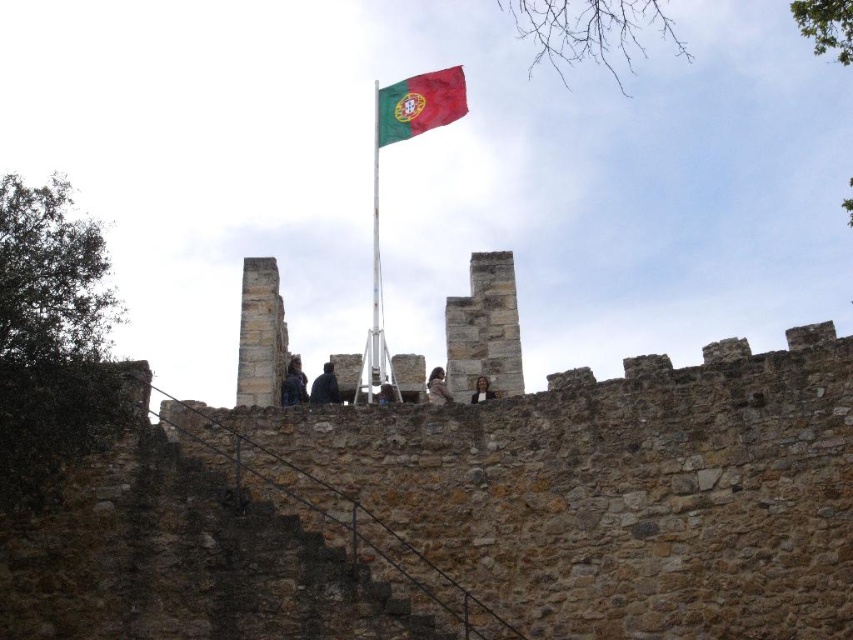
Question: Does silver metallic flag pole at center have a greater width compared to dark gray fabric jacket at center?

Choices:
 (A) yes
 (B) no

Answer: (A)

Question: Can you confirm if brown stone wall at upper center is positioned to the left of dark gray stone person at center?

Choices:
 (A) no
 (B) yes

Answer: (A)

Question: Can you confirm if dark gray fabric jacket at center is positioned to the left of smooth brown hair at center?

Choices:
 (A) yes
 (B) no

Answer: (A)

Question: Which object is the farthest from the brown stone wall at upper center?

Choices:
 (A) dark blue denim jacket at upper center
 (B) dark gray stone person at center
 (C) light brown leather jacket at center

Answer: (A)

Question: Which object is the farthest from the brown stone wall at upper center?

Choices:
 (A) silver metallic flag pole at center
 (B) dark gray stone person at center

Answer: (A)

Question: Which is nearer to the dark gray fabric jacket at center?

Choices:
 (A) dark blue denim jacket at upper center
 (B) silver metallic flag pole at center

Answer: (A)